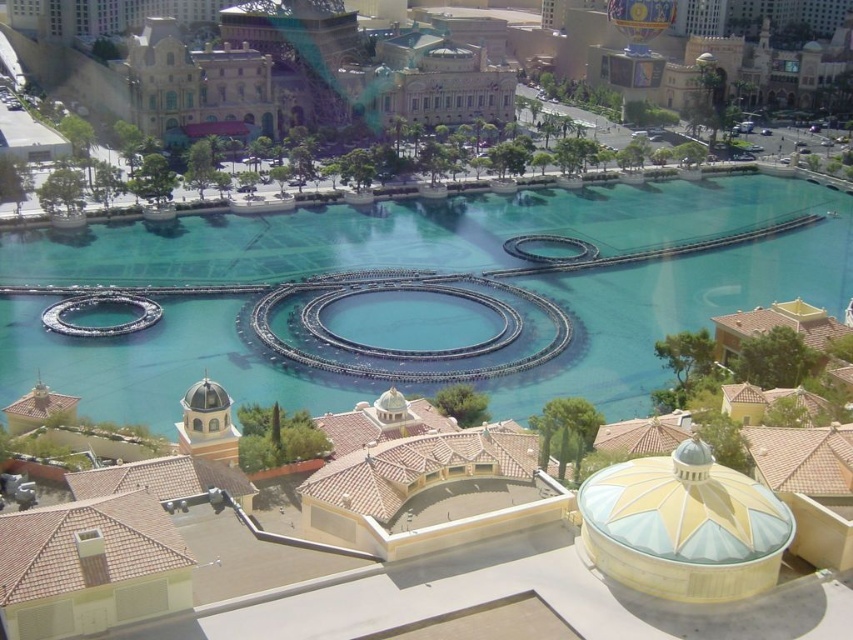
Is point (398, 250) behind point (432, 44)?

No, it is not.

Does clear blue water at center appear under beige stone building at upper center?

Yes.

Which is in front, point (44, 262) or point (258, 54)?

Point (44, 262) is in front.

What are the coordinates of `clear blue water at center` in the screenshot? It's located at (508, 262).